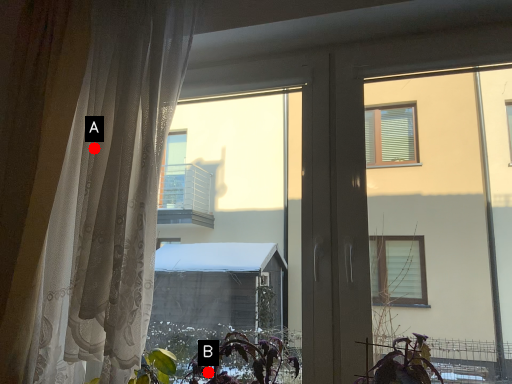
Question: Two points are circled on the image, labeled by A and B beside each circle. Which point is farther to the camera?

Choices:
 (A) A is further
 (B) B is further

Answer: (A)